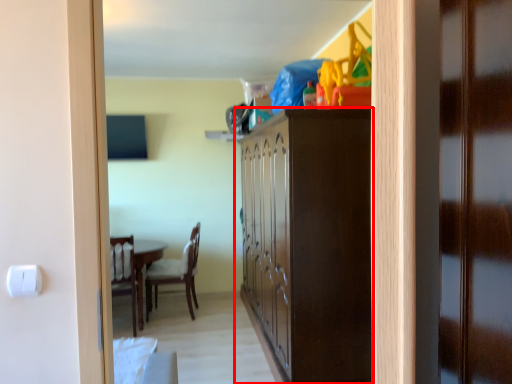
Question: Observing the image, what is the correct spatial positioning of cabinetry (annotated by the red box) in reference to door?

Choices:
 (A) left
 (B) right

Answer: (A)